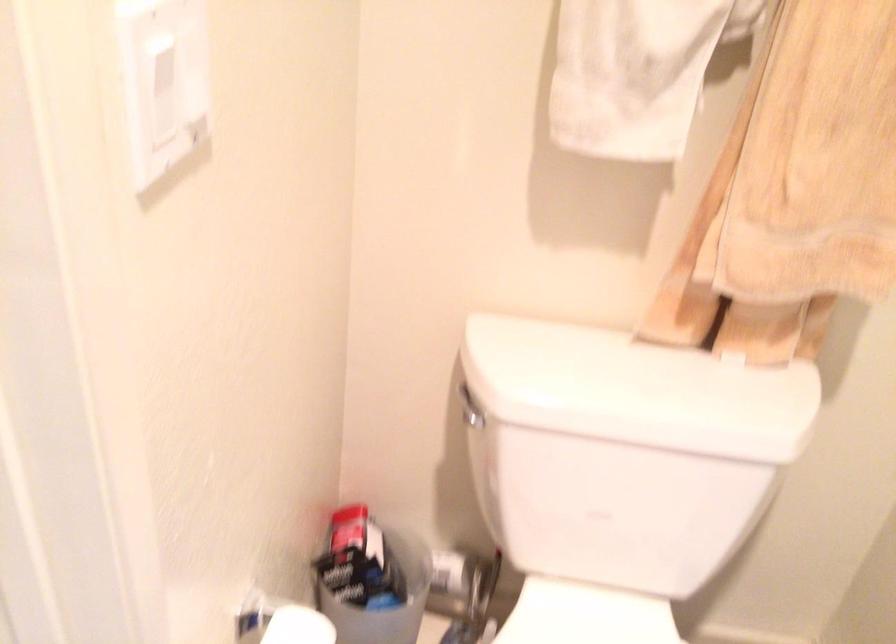
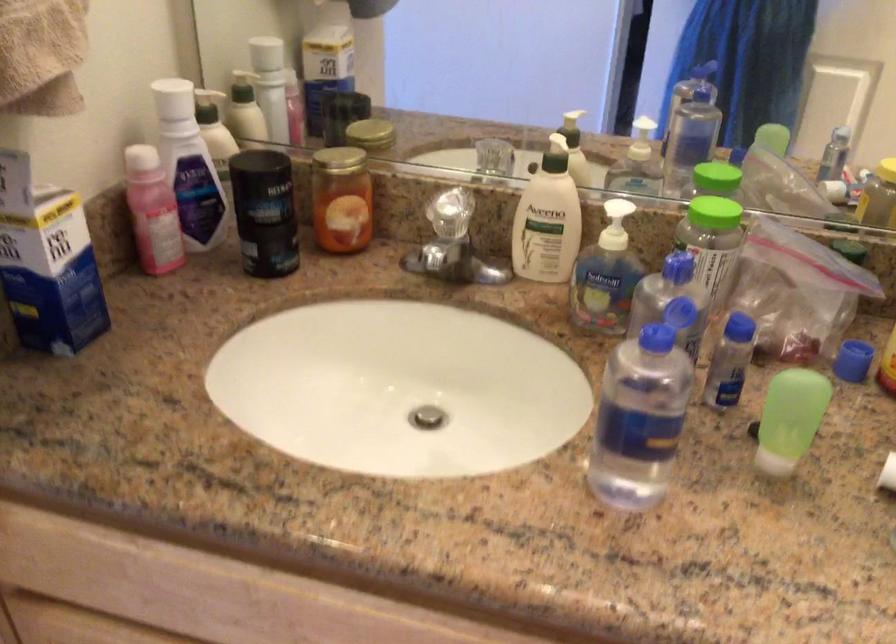
Question: In a continuous first-person perspective shot, in which direction is the camera moving?

Choices:
 (A) Left
 (B) Right
 (C) Forward
 (D) Backward

Answer: (A)